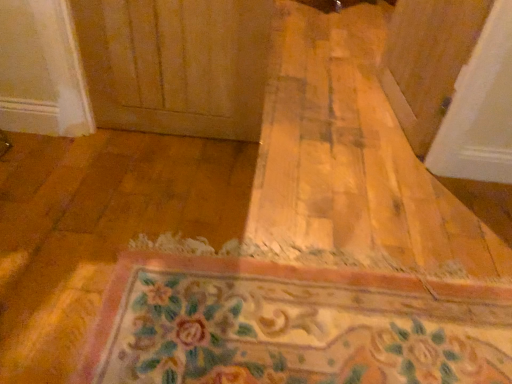
Question: Is transparent plastic screen door at upper right next to floral carpet at center and touching it?

Choices:
 (A) no
 (B) yes

Answer: (A)

Question: Would you say transparent plastic screen door at upper right contains floral carpet at center?

Choices:
 (A) no
 (B) yes

Answer: (A)

Question: From the image's perspective, is transparent plastic screen door at upper right beneath floral carpet at center?

Choices:
 (A) yes
 (B) no

Answer: (B)

Question: Is transparent plastic screen door at upper right behind floral carpet at center?

Choices:
 (A) no
 (B) yes

Answer: (B)

Question: Can you confirm if transparent plastic screen door at upper right is shorter than floral carpet at center?

Choices:
 (A) yes
 (B) no

Answer: (B)

Question: From a real-world perspective, is transparent plastic screen door at upper right below floral carpet at center?

Choices:
 (A) no
 (B) yes

Answer: (A)

Question: Is floral carpet at center wider than transparent plastic screen door at upper right?

Choices:
 (A) no
 (B) yes

Answer: (B)

Question: From a real-world perspective, is floral carpet at center located higher than transparent plastic screen door at upper right?

Choices:
 (A) no
 (B) yes

Answer: (A)

Question: Is floral carpet at center aimed at transparent plastic screen door at upper right?

Choices:
 (A) no
 (B) yes

Answer: (A)

Question: Is floral carpet at center positioned beyond the bounds of transparent plastic screen door at upper right?

Choices:
 (A) yes
 (B) no

Answer: (A)

Question: Considering the relative positions of floral carpet at center and transparent plastic screen door at upper right in the image provided, is floral carpet at center behind transparent plastic screen door at upper right?

Choices:
 (A) yes
 (B) no

Answer: (B)

Question: Considering the relative sizes of floral carpet at center and transparent plastic screen door at upper right in the image provided, is floral carpet at center bigger than transparent plastic screen door at upper right?

Choices:
 (A) yes
 (B) no

Answer: (B)

Question: In terms of width, does transparent plastic screen door at upper right look wider or thinner when compared to floral carpet at center?

Choices:
 (A) wide
 (B) thin

Answer: (B)